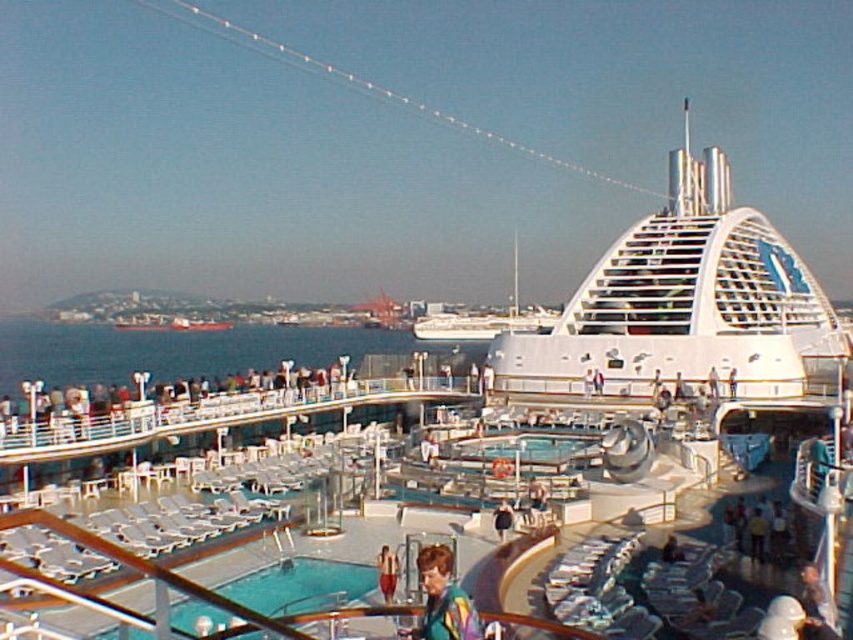
Question: Which of the following is the closest to the observer?

Choices:
 (A) (390, 564)
 (B) (428, 579)
 (C) (672, 550)

Answer: (B)

Question: Observing the image, what is the correct spatial positioning of dark blue shirt at center in reference to smooth skin at center?

Choices:
 (A) above
 (B) below

Answer: (A)

Question: Which point is closer to the camera taking this photo?

Choices:
 (A) (508, 531)
 (B) (445, 598)
 (C) (187, 321)

Answer: (B)

Question: Does red fabric shorts at center lie behind smooth skin at center?

Choices:
 (A) no
 (B) yes

Answer: (A)

Question: Which object is closer to the camera taking this photo?

Choices:
 (A) red fabric shorts at center
 (B) smooth skin at center
 (C) white glossy cruise ship at upper center
 (D) metallic gray ship at center

Answer: (A)

Question: From the image, what is the correct spatial relationship of multicolored fabric at center in relation to dark blue shirt at center?

Choices:
 (A) below
 (B) above

Answer: (B)